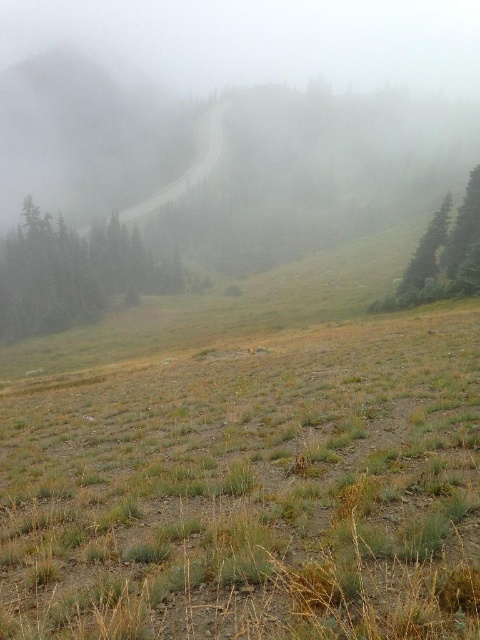
Question: Does dry grass at lower center appear on the left side of green matte tree at left?

Choices:
 (A) yes
 (B) no

Answer: (B)

Question: Which point is closer to the camera?

Choices:
 (A) green matte tree at right
 (B) green matte tree at left
 (C) dry grass at lower center

Answer: (C)

Question: Which object is positioned farthest from the green matte tree at left?

Choices:
 (A) green matte tree at right
 (B) dry grass at lower center

Answer: (B)

Question: Is green matte tree at left bigger than green matte tree at right?

Choices:
 (A) yes
 (B) no

Answer: (A)

Question: Which object is the farthest from the green matte tree at left?

Choices:
 (A) dry grass at lower center
 (B) green matte tree at right

Answer: (A)

Question: In this image, where is green matte tree at left located relative to green matte tree at right?

Choices:
 (A) left
 (B) right

Answer: (A)